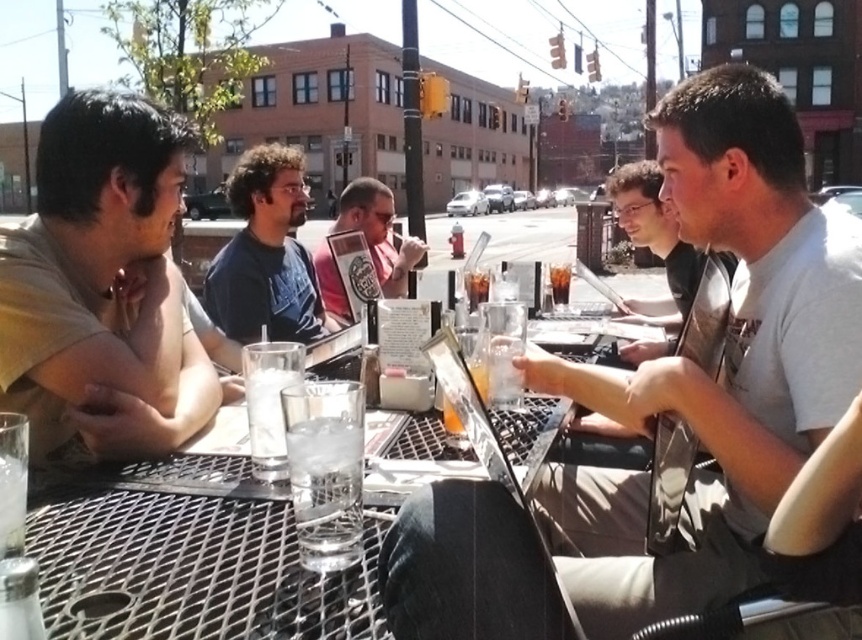
Can you confirm if clear glass at table center is taller than translucent glass at center?

Correct, clear glass at table center is much taller as translucent glass at center.

Can you confirm if clear glass at table center is positioned below translucent glass at center?

Yes, clear glass at table center is below translucent glass at center.

The height and width of the screenshot is (640, 862). What do you see at coordinates (267, 419) in the screenshot? I see `clear glass at table center` at bounding box center [267, 419].

Where is `clear glass at table center`? clear glass at table center is located at coordinates (267, 419).

Can you confirm if metallic mesh table at center is positioned below clear glass water at center?

Correct, metallic mesh table at center is located below clear glass water at center.

Locate an element on the screen. metallic mesh table at center is located at coordinates (186, 556).

Locate an element on the screen. The height and width of the screenshot is (640, 862). metallic mesh table at center is located at coordinates (186, 556).

Is metallic mesh table at center taller than dark blue t-shirt at center?

No.

Is metallic mesh table at center further to camera compared to dark blue t-shirt at center?

No, metallic mesh table at center is closer to the viewer.

Who is more distant from viewer, (x=228, y=554) or (x=267, y=212)?

The point (x=267, y=212) is more distant.

Identify the location of metallic mesh table at center. (186, 556).